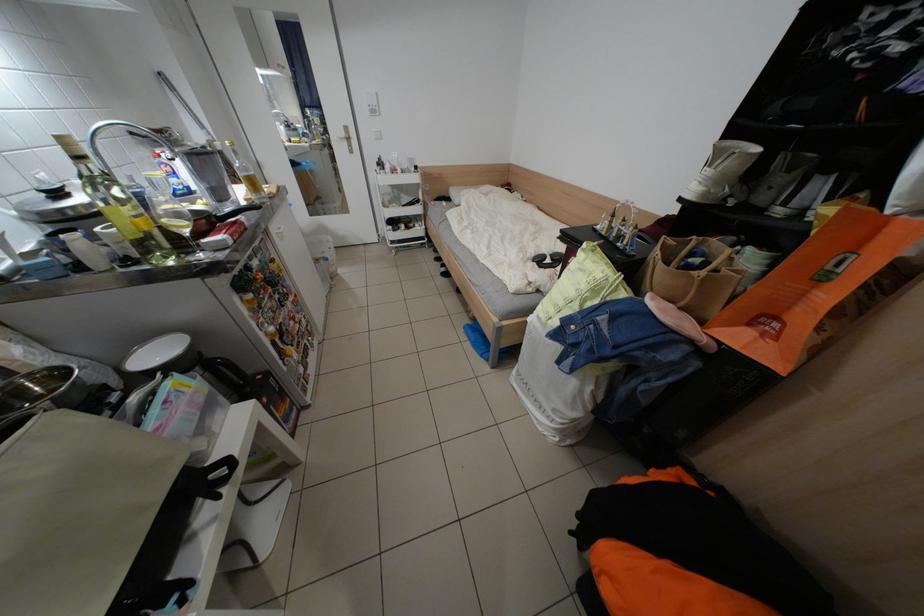
Image resolution: width=924 pixels, height=616 pixels. What do you see at coordinates (174, 217) in the screenshot?
I see `a drinking glass` at bounding box center [174, 217].